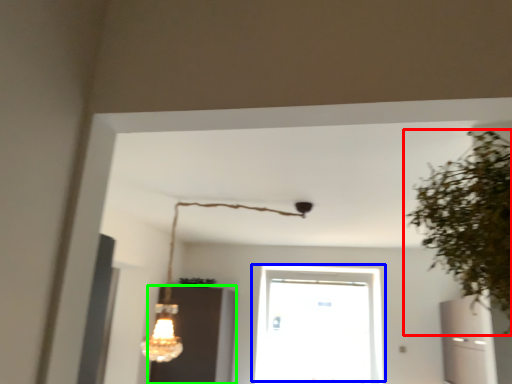
Question: Based on their relative distances, which object is farther from houseplant (highlighted by a red box)? Choose from window (highlighted by a blue box) and cabinetry (highlighted by a green box).

Choices:
 (A) window
 (B) cabinetry

Answer: (A)